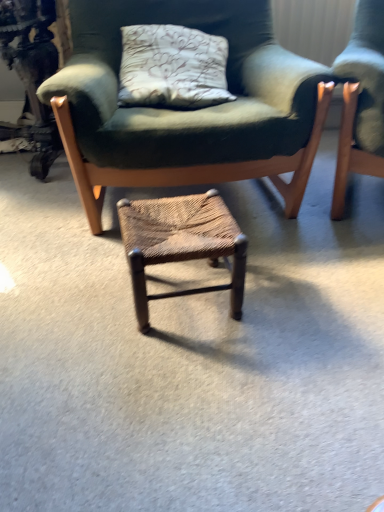
Question: Is point (142, 11) closer or farther from the camera than point (226, 229)?

Choices:
 (A) closer
 (B) farther

Answer: (B)

Question: Looking at the image, does green fabric chair at center seem bigger or smaller compared to woven brown stool at center?

Choices:
 (A) big
 (B) small

Answer: (A)

Question: From their relative heights in the image, would you say green fabric chair at center is taller or shorter than woven brown stool at center?

Choices:
 (A) tall
 (B) short

Answer: (A)

Question: Is point (235, 305) closer or farther from the camera than point (157, 157)?

Choices:
 (A) closer
 (B) farther

Answer: (A)

Question: Is woven brown stool at center in front of or behind green fabric chair at center in the image?

Choices:
 (A) front
 (B) behind

Answer: (A)

Question: In terms of width, does woven brown stool at center look wider or thinner when compared to green fabric chair at center?

Choices:
 (A) wide
 (B) thin

Answer: (B)

Question: From the image's perspective, relative to green fabric chair at center, is woven brown stool at center above or below?

Choices:
 (A) below
 (B) above

Answer: (A)